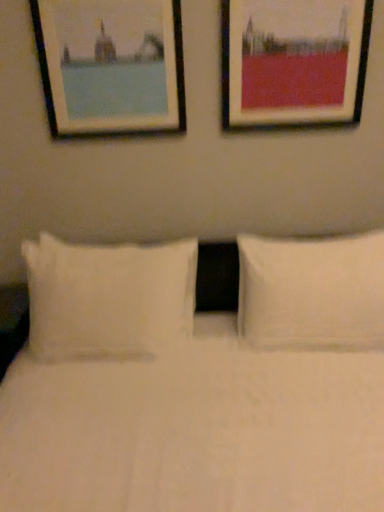
Measure the distance between wooden frame at upper left, which is the 1th picture frame from left to right, and camera.

wooden frame at upper left, which is the 1th picture frame from left to right, and camera are 5.09 feet apart.

The width and height of the screenshot is (384, 512). What are the coordinates of `matte black picture frame at upper right, the second picture frame in the left-to-right sequence` in the screenshot? It's located at (293, 61).

Where is `white soft pillow at left, which is the second pillow in right-to-left order`? white soft pillow at left, which is the second pillow in right-to-left order is located at coordinates (108, 298).

Describe the element at coordinates (312, 293) in the screenshot. I see `white soft pillow at right, the second pillow viewed from the left` at that location.

The width and height of the screenshot is (384, 512). I want to click on white soft pillow at right, which appears as the 1th pillow when viewed from the right, so click(x=312, y=293).

The width and height of the screenshot is (384, 512). Identify the location of wooden frame at upper left, which is the 1th picture frame from left to right. (111, 66).

How different are the orientations of white soft pillow at right, which appears as the 1th pillow when viewed from the right, and matte black picture frame at upper right, the first picture frame viewed from the right, in degrees?

The facing directions of white soft pillow at right, which appears as the 1th pillow when viewed from the right, and matte black picture frame at upper right, the first picture frame viewed from the right, are 0.728 degrees apart.

Which object is positioned more to the right, white soft pillow at right, the second pillow viewed from the left, or matte black picture frame at upper right, the second picture frame in the left-to-right sequence?

white soft pillow at right, the second pillow viewed from the left, is more to the right.

Is white soft pillow at right, which appears as the 1th pillow when viewed from the right, far from matte black picture frame at upper right, the second picture frame in the left-to-right sequence?

No, white soft pillow at right, which appears as the 1th pillow when viewed from the right, is in close proximity to matte black picture frame at upper right, the second picture frame in the left-to-right sequence.

From a real-world perspective, which object stands above the other?

matte black picture frame at upper right, the second picture frame in the left-to-right sequence, from a real-world perspective.

In the scene shown: In the image, is white soft pillow at left, the first pillow viewed from the left, positioned in front of or behind matte black picture frame at upper right, the second picture frame in the left-to-right sequence?

white soft pillow at left, the first pillow viewed from the left, is positioned closer to the viewer than matte black picture frame at upper right, the second picture frame in the left-to-right sequence.

From the image's perspective, starting from the matte black picture frame at upper right, the second picture frame in the left-to-right sequence, which pillow is the 2nd one below? Please provide its 2D coordinates.

[(108, 298)]

Is wooden frame at upper left, which is the 1th picture frame from left to right, far away from white soft pillow at left, the first pillow viewed from the left?

They are positioned close to each other.

Could white soft pillow at left, which is the second pillow in right-to-left order, be considered to be inside wooden frame at upper left, marked as the second picture frame in a right-to-left arrangement?

No.

Considering the relative positions of wooden frame at upper left, marked as the second picture frame in a right-to-left arrangement, and white soft pillow at left, which is the second pillow in right-to-left order, in the image provided, is wooden frame at upper left, marked as the second picture frame in a right-to-left arrangement, to the left of white soft pillow at left, which is the second pillow in right-to-left order, from the viewer's perspective?

No.

What are the coordinates of `pillow that is the 2nd object located in front of the matte black picture frame at upper right, the first picture frame viewed from the right` in the screenshot? It's located at (108, 298).

Are matte black picture frame at upper right, the first picture frame viewed from the right, and white soft pillow at left, which is the second pillow in right-to-left order, far apart?

No, there isn't a large distance between matte black picture frame at upper right, the first picture frame viewed from the right, and white soft pillow at left, which is the second pillow in right-to-left order.

Considering the relative sizes of matte black picture frame at upper right, the first picture frame viewed from the right, and white soft pillow at left, which is the second pillow in right-to-left order, in the image provided, is matte black picture frame at upper right, the first picture frame viewed from the right, taller than white soft pillow at left, which is the second pillow in right-to-left order,?

Incorrect, the height of matte black picture frame at upper right, the first picture frame viewed from the right, is not larger of that of white soft pillow at left, which is the second pillow in right-to-left order.

From a real-world perspective, is matte black picture frame at upper right, the first picture frame viewed from the right, physically located above or below white soft pillow at left, the first pillow viewed from the left?

Clearly, from a real-world perspective, matte black picture frame at upper right, the first picture frame viewed from the right, is above white soft pillow at left, the first pillow viewed from the left.

Is white soft pillow at right, the second pillow viewed from the left, oriented towards white soft pillow at left, which is the second pillow in right-to-left order?

No, white soft pillow at right, the second pillow viewed from the left, does not turn towards white soft pillow at left, which is the second pillow in right-to-left order.

Considering the relative positions of white soft pillow at right, the second pillow viewed from the left, and white soft pillow at left, the first pillow viewed from the left, in the image provided, is white soft pillow at right, the second pillow viewed from the left, to the left or to the right of white soft pillow at left, the first pillow viewed from the left,?

From the image, it's evident that white soft pillow at right, the second pillow viewed from the left, is to the right of white soft pillow at left, the first pillow viewed from the left.

Locate an element on the screen. The height and width of the screenshot is (512, 384). pillow below the white soft pillow at left, the first pillow viewed from the left (from a real-world perspective) is located at coordinates (312, 293).

Could you tell me if white soft pillow at right, which appears as the 1th pillow when viewed from the right, is turned towards wooden frame at upper left, which is the 1th picture frame from left to right?

No, white soft pillow at right, which appears as the 1th pillow when viewed from the right, is not turned towards wooden frame at upper left, which is the 1th picture frame from left to right.

Considering the sizes of objects white soft pillow at right, which appears as the 1th pillow when viewed from the right, and wooden frame at upper left, which is the 1th picture frame from left to right, in the image provided, who is thinner, white soft pillow at right, which appears as the 1th pillow when viewed from the right, or wooden frame at upper left, which is the 1th picture frame from left to right,?

With smaller width is wooden frame at upper left, which is the 1th picture frame from left to right.

Is white soft pillow at right, the second pillow viewed from the left, beside wooden frame at upper left, which is the 1th picture frame from left to right?

No, white soft pillow at right, the second pillow viewed from the left, is not beside wooden frame at upper left, which is the 1th picture frame from left to right.

Is point (322, 291) farther from camera compared to point (98, 108)?

No.

Between white soft pillow at left, which is the second pillow in right-to-left order, and white soft pillow at right, which appears as the 1th pillow when viewed from the right, which one has smaller size?

white soft pillow at left, which is the second pillow in right-to-left order.

Identify the location of pillow that is below the white soft pillow at right, which appears as the 1th pillow when viewed from the right (from the image's perspective). (108, 298).

In the scene shown: Considering the sizes of objects white soft pillow at left, the first pillow viewed from the left, and white soft pillow at right, which appears as the 1th pillow when viewed from the right, in the image provided, who is shorter, white soft pillow at left, the first pillow viewed from the left, or white soft pillow at right, which appears as the 1th pillow when viewed from the right,?

With less height is white soft pillow at left, the first pillow viewed from the left.

I want to click on the 1st picture frame directly above the white soft pillow at right, which appears as the 1th pillow when viewed from the right (from a real-world perspective), so click(x=293, y=61).

Where is `the 2nd pillow in front of the matte black picture frame at upper right, the first picture frame viewed from the right`? the 2nd pillow in front of the matte black picture frame at upper right, the first picture frame viewed from the right is located at coordinates (108, 298).

Which object lies further to the anchor point white soft pillow at left, which is the second pillow in right-to-left order, white soft pillow at right, which appears as the 1th pillow when viewed from the right, or matte black picture frame at upper right, the first picture frame viewed from the right?

matte black picture frame at upper right, the first picture frame viewed from the right, is positioned further to the anchor white soft pillow at left, which is the second pillow in right-to-left order.

From the image, which object appears to be nearer to wooden frame at upper left, which is the 1th picture frame from left to right, white soft pillow at left, the first pillow viewed from the left, or matte black picture frame at upper right, the second picture frame in the left-to-right sequence?

matte black picture frame at upper right, the second picture frame in the left-to-right sequence, lies closer to wooden frame at upper left, which is the 1th picture frame from left to right, than the other object.

Looking at the image, which one is located closer to matte black picture frame at upper right, the second picture frame in the left-to-right sequence, white soft pillow at left, which is the second pillow in right-to-left order, or wooden frame at upper left, marked as the second picture frame in a right-to-left arrangement?

Among the two, wooden frame at upper left, marked as the second picture frame in a right-to-left arrangement, is located nearer to matte black picture frame at upper right, the second picture frame in the left-to-right sequence.

Looking at the image, which one is located closer to white soft pillow at left, the first pillow viewed from the left, matte black picture frame at upper right, the first picture frame viewed from the right, or white soft pillow at right, the second pillow viewed from the left?

white soft pillow at right, the second pillow viewed from the left.

Looking at the image, which one is located further to wooden frame at upper left, marked as the second picture frame in a right-to-left arrangement, white soft pillow at left, the first pillow viewed from the left, or white soft pillow at right, which appears as the 1th pillow when viewed from the right?

white soft pillow at right, which appears as the 1th pillow when viewed from the right, is further to wooden frame at upper left, marked as the second picture frame in a right-to-left arrangement.

Which object lies nearer to the anchor point white soft pillow at left, which is the second pillow in right-to-left order, white soft pillow at right, which appears as the 1th pillow when viewed from the right, or wooden frame at upper left, marked as the second picture frame in a right-to-left arrangement?

The object closer to white soft pillow at left, which is the second pillow in right-to-left order, is white soft pillow at right, which appears as the 1th pillow when viewed from the right.

Estimate the real-world distances between objects in this image. Which object is closer to wooden frame at upper left, marked as the second picture frame in a right-to-left arrangement, matte black picture frame at upper right, the first picture frame viewed from the right, or white soft pillow at right, the second pillow viewed from the left?

matte black picture frame at upper right, the first picture frame viewed from the right, lies closer to wooden frame at upper left, marked as the second picture frame in a right-to-left arrangement, than the other object.

Looking at the image, which one is located closer to matte black picture frame at upper right, the second picture frame in the left-to-right sequence, white soft pillow at right, the second pillow viewed from the left, or wooden frame at upper left, marked as the second picture frame in a right-to-left arrangement?

wooden frame at upper left, marked as the second picture frame in a right-to-left arrangement.

The width and height of the screenshot is (384, 512). Identify the location of picture frame between matte black picture frame at upper right, the second picture frame in the left-to-right sequence, and white soft pillow at right, the second pillow viewed from the left, vertically. (111, 66).

This screenshot has height=512, width=384. What are the coordinates of `pillow between matte black picture frame at upper right, the first picture frame viewed from the right, and white soft pillow at left, which is the second pillow in right-to-left order, from top to bottom` in the screenshot? It's located at (312, 293).

Identify the location of picture frame between matte black picture frame at upper right, the second picture frame in the left-to-right sequence, and white soft pillow at left, the first pillow viewed from the left, from top to bottom. The height and width of the screenshot is (512, 384). (111, 66).

Locate an element on the screen. Image resolution: width=384 pixels, height=512 pixels. pillow between wooden frame at upper left, marked as the second picture frame in a right-to-left arrangement, and white soft pillow at left, which is the second pillow in right-to-left order, from top to bottom is located at coordinates (312, 293).